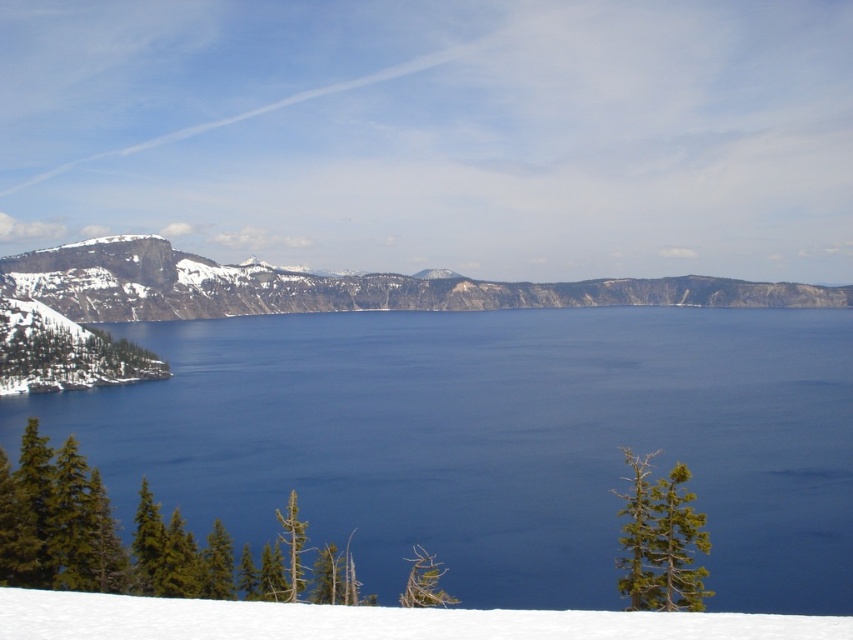
You are standing at the point closest to the camera in the image. Which point, point (595,298) or point (149,552), is farther away from you?

Point (595,298) is farther away because it is behind point (149,552).

You are an explorer trying to navigate through the snowy terrain. You see the deep blue water at center and the green matte tree at upper right. Which object is located more to the right side?

The green matte tree at upper right is more to the right side because the deep blue water at center is positioned on its left side.

You are a hiker standing at the point marked by the coordinates point (332,285) in the image. What is the terrain like at your current location?

The point (332,285) indicates a dark gray rocky cliff at center, so the terrain at your current location is a rocky cliff.